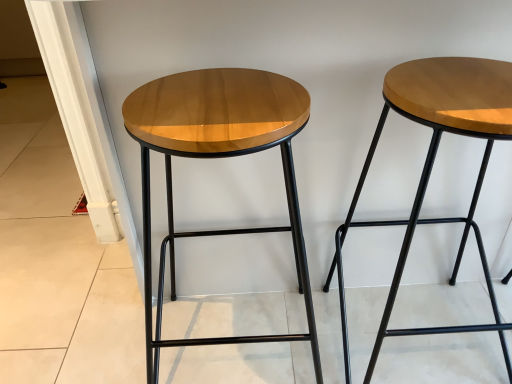
This screenshot has height=384, width=512. What do you see at coordinates (433, 163) in the screenshot?
I see `glossy wood stool at right, the 1th stool from the right` at bounding box center [433, 163].

Where is `glossy wood stool at right, which ranks as the second stool in left-to-right order`? This screenshot has width=512, height=384. glossy wood stool at right, which ranks as the second stool in left-to-right order is located at coordinates (433, 163).

What is the approximate width of glossy wood stool at left, placed as the second stool when sorted from right to left?

It is 15.86 inches.

Describe the element at coordinates (218, 157) in the screenshot. Image resolution: width=512 pixels, height=384 pixels. I see `glossy wood stool at left, placed as the second stool when sorted from right to left` at that location.

I want to click on glossy wood stool at left, placed as the second stool when sorted from right to left, so click(218, 157).

Where is `glossy wood stool at right, which ranks as the second stool in left-to-right order`? glossy wood stool at right, which ranks as the second stool in left-to-right order is located at coordinates (433, 163).

Is glossy wood stool at right, which ranks as the second stool in left-to-right order, to the right of glossy wood stool at left, placed as the second stool when sorted from right to left, from the viewer's perspective?

Indeed, glossy wood stool at right, which ranks as the second stool in left-to-right order, is positioned on the right side of glossy wood stool at left, placed as the second stool when sorted from right to left.

Which object is more forward, glossy wood stool at right, the 1th stool from the right, or glossy wood stool at left, placed as the second stool when sorted from right to left?

glossy wood stool at left, placed as the second stool when sorted from right to left, is more forward.

Between point (343, 349) and point (282, 107), which one is positioned behind?

The point (343, 349) is behind.

From the image's perspective, is glossy wood stool at right, the 1th stool from the right, on top of glossy wood stool at left, placed as the second stool when sorted from right to left?

Yes, from the image's perspective, glossy wood stool at right, the 1th stool from the right, is on top of glossy wood stool at left, placed as the second stool when sorted from right to left.

From a real-world perspective, is glossy wood stool at right, the 1th stool from the right, physically below glossy wood stool at left, placed as the second stool when sorted from right to left?

Yes, from a real-world perspective, glossy wood stool at right, the 1th stool from the right, is beneath glossy wood stool at left, placed as the second stool when sorted from right to left.

Considering the sizes of objects glossy wood stool at right, which ranks as the second stool in left-to-right order, and glossy wood stool at left, placed as the second stool when sorted from right to left, in the image provided, who is wider, glossy wood stool at right, which ranks as the second stool in left-to-right order, or glossy wood stool at left, placed as the second stool when sorted from right to left,?

glossy wood stool at left, placed as the second stool when sorted from right to left, is wider.

Does glossy wood stool at right, the 1th stool from the right, have a greater height compared to glossy wood stool at left, placed as the second stool when sorted from right to left?

No.

Between glossy wood stool at right, the 1th stool from the right, and glossy wood stool at left, the 1th stool positioned from the left, which one has smaller size?

glossy wood stool at right, the 1th stool from the right.

Which is correct: glossy wood stool at right, which ranks as the second stool in left-to-right order, is inside glossy wood stool at left, placed as the second stool when sorted from right to left, or outside of it?

glossy wood stool at right, which ranks as the second stool in left-to-right order, is not inside glossy wood stool at left, placed as the second stool when sorted from right to left, it's outside.

Is glossy wood stool at right, which ranks as the second stool in left-to-right order, oriented towards glossy wood stool at left, the 1th stool positioned from the left?

No, glossy wood stool at right, which ranks as the second stool in left-to-right order, is not turned towards glossy wood stool at left, the 1th stool positioned from the left.

How different are the orientations of glossy wood stool at right, the 1th stool from the right, and glossy wood stool at left, placed as the second stool when sorted from right to left, in degrees?

They differ by 0.000426 degrees in their facing directions.

Where is `stool above the glossy wood stool at right, which ranks as the second stool in left-to-right order (from a real-world perspective)`? Image resolution: width=512 pixels, height=384 pixels. stool above the glossy wood stool at right, which ranks as the second stool in left-to-right order (from a real-world perspective) is located at coordinates (218, 157).

In the scene shown: Which object is positioned more to the right, glossy wood stool at left, placed as the second stool when sorted from right to left, or glossy wood stool at right, the 1th stool from the right?

Positioned to the right is glossy wood stool at right, the 1th stool from the right.

Considering their positions, is glossy wood stool at left, placed as the second stool when sorted from right to left, located in front of or behind glossy wood stool at right, which ranks as the second stool in left-to-right order?

Clearly, glossy wood stool at left, placed as the second stool when sorted from right to left, is in front of glossy wood stool at right, which ranks as the second stool in left-to-right order.

Is point (143, 111) more distant than point (463, 134)?

No, it is not.

From the image's perspective, which object appears higher, glossy wood stool at left, placed as the second stool when sorted from right to left, or glossy wood stool at right, which ranks as the second stool in left-to-right order?

glossy wood stool at right, which ranks as the second stool in left-to-right order, from the image's perspective.

From a real-world perspective, between glossy wood stool at left, the 1th stool positioned from the left, and glossy wood stool at right, the 1th stool from the right, who is vertically higher?

In real-world perspective, glossy wood stool at left, the 1th stool positioned from the left, is above.

Does glossy wood stool at left, the 1th stool positioned from the left, have a greater width compared to glossy wood stool at right, which ranks as the second stool in left-to-right order?

Indeed, glossy wood stool at left, the 1th stool positioned from the left, has a greater width compared to glossy wood stool at right, which ranks as the second stool in left-to-right order.

From their relative heights in the image, would you say glossy wood stool at left, placed as the second stool when sorted from right to left, is taller or shorter than glossy wood stool at right, which ranks as the second stool in left-to-right order?

In the image, glossy wood stool at left, placed as the second stool when sorted from right to left, appears to be taller than glossy wood stool at right, which ranks as the second stool in left-to-right order.

Is glossy wood stool at left, the 1th stool positioned from the left, smaller than glossy wood stool at right, the 1th stool from the right?

No, glossy wood stool at left, the 1th stool positioned from the left, is not smaller than glossy wood stool at right, the 1th stool from the right.

Is glossy wood stool at left, the 1th stool positioned from the left, located outside glossy wood stool at right, which ranks as the second stool in left-to-right order?

That's correct, glossy wood stool at left, the 1th stool positioned from the left, is outside of glossy wood stool at right, which ranks as the second stool in left-to-right order.

Is there a large distance between glossy wood stool at left, the 1th stool positioned from the left, and glossy wood stool at right, which ranks as the second stool in left-to-right order?

No, glossy wood stool at left, the 1th stool positioned from the left, is in close proximity to glossy wood stool at right, which ranks as the second stool in left-to-right order.

Is glossy wood stool at left, placed as the second stool when sorted from right to left, aimed at glossy wood stool at right, which ranks as the second stool in left-to-right order?

No, glossy wood stool at left, placed as the second stool when sorted from right to left, is not oriented towards glossy wood stool at right, which ranks as the second stool in left-to-right order.

Looking at this image, how many degrees apart are the facing directions of glossy wood stool at left, the 1th stool positioned from the left, and glossy wood stool at right, the 1th stool from the right?

The facing directions of glossy wood stool at left, the 1th stool positioned from the left, and glossy wood stool at right, the 1th stool from the right, are 0.000426 degrees apart.

How much distance is there between glossy wood stool at left, the 1th stool positioned from the left, and glossy wood stool at right, the 1th stool from the right?

12.10 inches.

Where is `stool that is on the right side of glossy wood stool at left, the 1th stool positioned from the left`? stool that is on the right side of glossy wood stool at left, the 1th stool positioned from the left is located at coordinates pyautogui.click(x=433, y=163).

I want to click on stool behind the glossy wood stool at left, the 1th stool positioned from the left, so (x=433, y=163).

In order to click on stool above the glossy wood stool at right, the 1th stool from the right (from a real-world perspective) in this screenshot , I will do `click(218, 157)`.